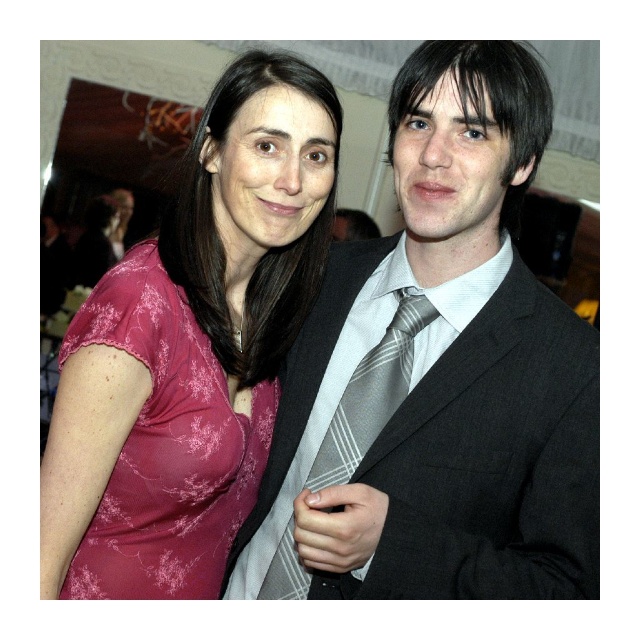
Question: Is gray striped tie at center above silver striped tie at center?

Choices:
 (A) no
 (B) yes

Answer: (B)

Question: Can you confirm if pink floral fabric dress at left is smaller than silver striped tie at center?

Choices:
 (A) no
 (B) yes

Answer: (A)

Question: Which object is farther from the camera taking this photo?

Choices:
 (A) pink floral dress at center
 (B) silver striped tie at center

Answer: (B)

Question: Which of the following is the farthest from the observer?

Choices:
 (A) (397, 314)
 (B) (182, 545)
 (C) (257, 99)

Answer: (B)

Question: Is gray striped tie at center behind pink floral dress at center?

Choices:
 (A) yes
 (B) no

Answer: (B)

Question: Which point appears closest to the camera in this image?

Choices:
 (A) (346, 394)
 (B) (106, 433)

Answer: (B)